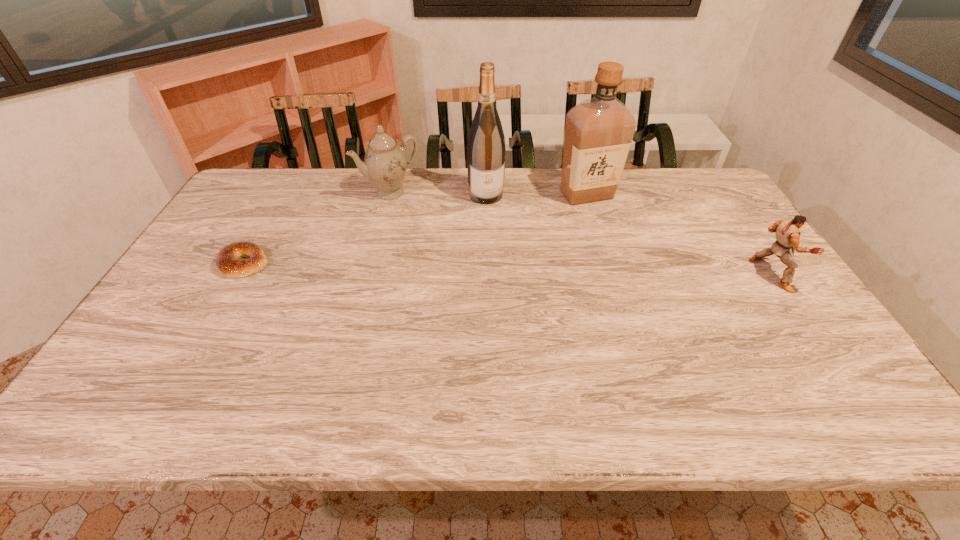
Identify the location of vacant area between the second shortest object and the chinaware. The width and height of the screenshot is (960, 540). (581, 233).

Locate an element on the screen. The image size is (960, 540). empty space that is in between the shortest object and the rightmost object is located at coordinates (508, 269).

The width and height of the screenshot is (960, 540). I want to click on free space between the third tallest object and the puncher, so click(581, 233).

This screenshot has height=540, width=960. In order to click on free spot between the liquor and the rightmost object in this screenshot , I will do `click(679, 234)`.

Locate an element on the screen. The image size is (960, 540). vacant area that lies between the chinaware and the leftmost object is located at coordinates (317, 228).

Identify which object is the closest to the shortest object. Please provide its 2D coordinates. Your answer should be formatted as a tuple, i.e. [(x, y)], where the tuple contains the x and y coordinates of a point satisfying the conditions above.

[(385, 163)]

At what (x,y) coordinates should I click in order to perform the action: click on object that can be found as the fourth closest to the fourth object from right to left. Please return your answer as a coordinate pair (x, y). The height and width of the screenshot is (540, 960). Looking at the image, I should click on (787, 231).

Find the location of `vacant area in the image that satisfies the following two spatial constraints: 1. on the front side of the puncher; 2. on the front-facing side of the fourth object from left to right`. vacant area in the image that satisfies the following two spatial constraints: 1. on the front side of the puncher; 2. on the front-facing side of the fourth object from left to right is located at coordinates (612, 274).

At what (x,y) coordinates should I click in order to perform the action: click on free point that satisfies the following two spatial constraints: 1. on the front side of the fourth object from left to right; 2. on the right side of the chinaware. Please return your answer as a coordinate pair (x, y). The height and width of the screenshot is (540, 960). Looking at the image, I should click on (390, 194).

Locate an element on the screen. free spot that satisfies the following two spatial constraints: 1. on the front side of the wine bottle; 2. on the front-facing side of the fourth tallest object is located at coordinates (488, 274).